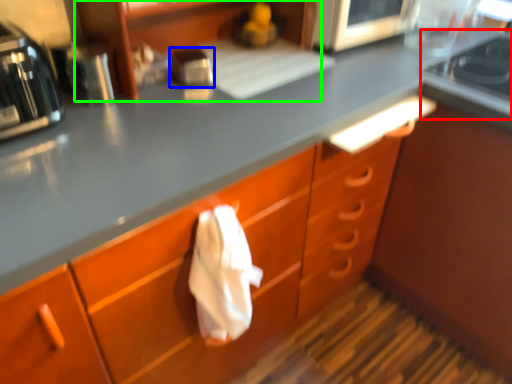
Question: Based on their relative distances, which object is nearer to gas stove (highlighted by a red box)? Choose from kitchen appliance (highlighted by a blue box) and shelf (highlighted by a green box).

Choices:
 (A) kitchen appliance
 (B) shelf

Answer: (B)